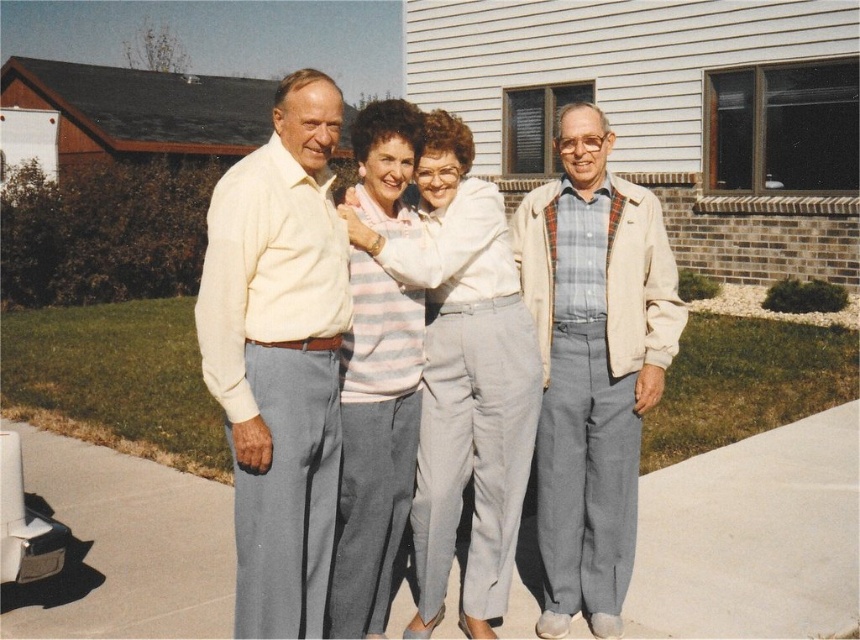
Between light gray pants at center and light beige jacket at right, which one is positioned higher?

light gray pants at center is above.

Which is more to the right, light gray pants at center or light beige jacket at right?

Positioned to the right is light beige jacket at right.

Which is in front, point (511, 404) or point (575, 522)?

Point (511, 404) is more forward.

In order to click on light gray pants at center in this screenshot , I will do `click(462, 365)`.

Between light gray cotton pants at center and striped knit sweater at center, which one is positioned higher?

striped knit sweater at center is above.

Can you confirm if light gray cotton pants at center is wider than striped knit sweater at center?

Correct, the width of light gray cotton pants at center exceeds that of striped knit sweater at center.

Between point (465, 252) and point (415, 330), which one is positioned behind?

The point (415, 330) is behind.

Locate an element on the screen. Image resolution: width=860 pixels, height=640 pixels. light gray cotton pants at center is located at coordinates (464, 378).

Which is more to the left, light beige jacket at right or striped knit sweater at center?

striped knit sweater at center is more to the left.

Measure the distance from light beige jacket at right to striped knit sweater at center.

light beige jacket at right and striped knit sweater at center are 30.43 inches apart.

Is point (656, 257) less distant than point (381, 269)?

No.

Where is `light beige jacket at right`? light beige jacket at right is located at coordinates (593, 365).